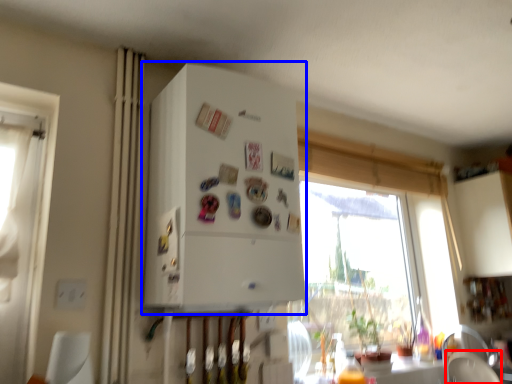
Question: Which point is further to the camera, armchair (highlighted by a red box) or appliance (highlighted by a blue box)?

Choices:
 (A) armchair
 (B) appliance

Answer: (A)